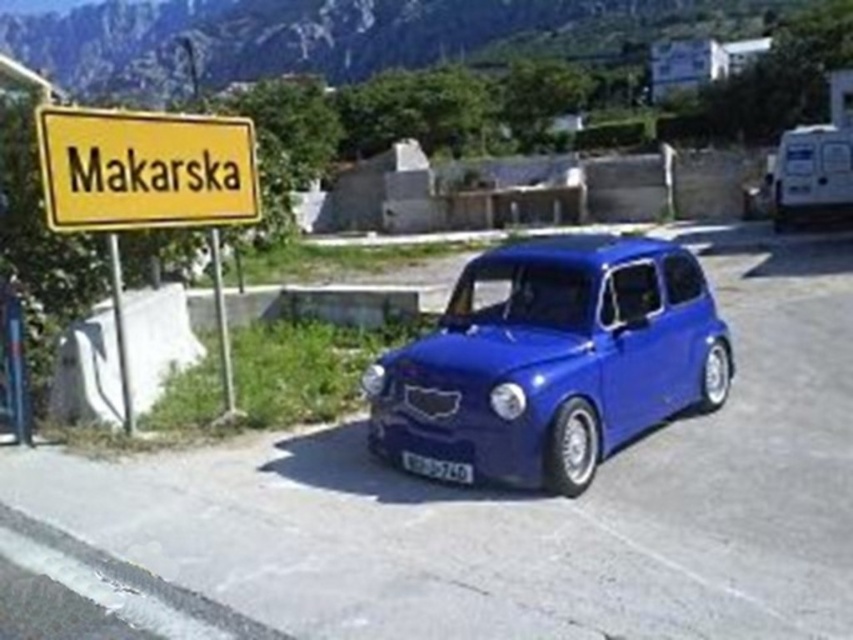
Question: From the image, what is the correct spatial relationship of glossy blue car at center in relation to yellow plastic sign at upper left?

Choices:
 (A) right
 (B) left

Answer: (A)

Question: Which of the following is the closest to the observer?

Choices:
 (A) (421, 461)
 (B) (201, 202)
 (C) (567, 352)

Answer: (C)

Question: Based on their relative distances, which object is nearer to the white plastic license plate at center?

Choices:
 (A) glossy blue car at center
 (B) yellow plastic sign at upper left

Answer: (A)

Question: Is glossy blue car at center to the right of yellow plastic sign at upper left from the viewer's perspective?

Choices:
 (A) no
 (B) yes

Answer: (B)

Question: Based on their relative distances, which object is nearer to the yellow plastic sign at upper left?

Choices:
 (A) white plastic license plate at center
 (B) glossy blue car at center

Answer: (B)

Question: Is glossy blue car at center to the left of white plastic license plate at center from the viewer's perspective?

Choices:
 (A) yes
 (B) no

Answer: (B)